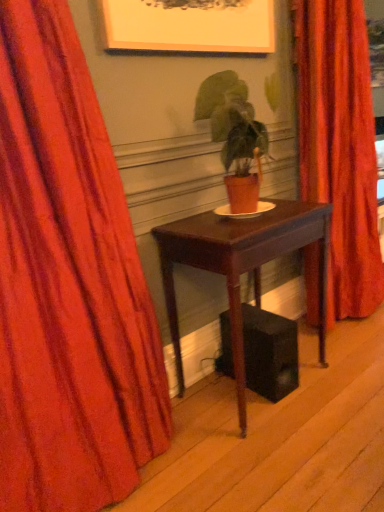
The height and width of the screenshot is (512, 384). Find the location of `vacant point to the right of mahogany wood table at center`. vacant point to the right of mahogany wood table at center is located at coordinates (343, 373).